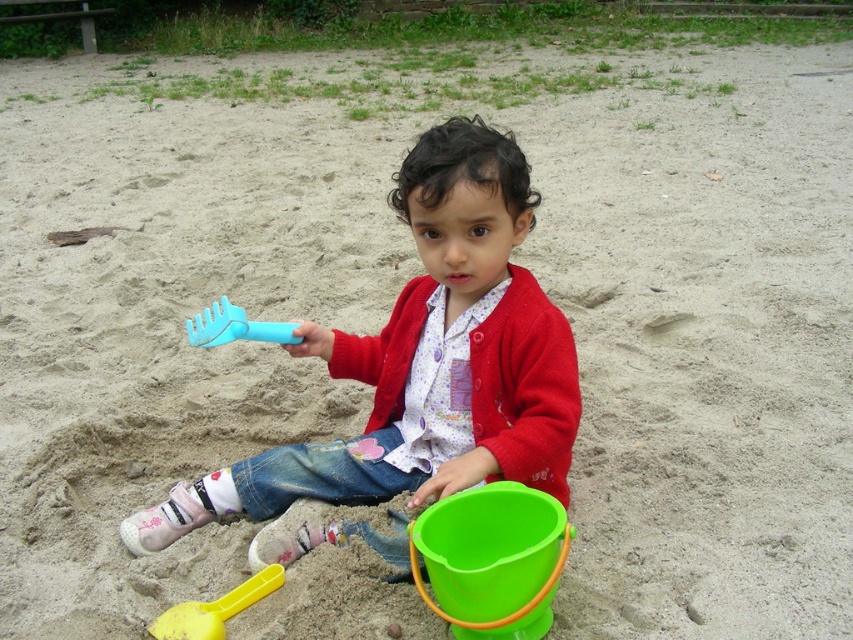
Is the position of matte plastic toddler at center less distant than that of green plastic bucket at lower center?

No, matte plastic toddler at center is further to the viewer.

In the scene shown: Measure the distance between matte plastic toddler at center and green plastic bucket at lower center.

The distance of matte plastic toddler at center from green plastic bucket at lower center is 8.41 inches.

I want to click on matte plastic toddler at center, so click(x=425, y=362).

Which is in front, point (535, 404) or point (260, 330)?

Point (535, 404) is in front.

Between matte plastic toddler at center and blue plastic rake at center, which one appears on the right side from the viewer's perspective?

matte plastic toddler at center is more to the right.

The height and width of the screenshot is (640, 853). Identify the location of matte plastic toddler at center. (425, 362).

Does green plastic bucket at lower center appear over yellow plastic shovel at lower left?

Yes, green plastic bucket at lower center is above yellow plastic shovel at lower left.

Is green plastic bucket at lower center shorter than yellow plastic shovel at lower left?

Incorrect, green plastic bucket at lower center's height does not fall short of yellow plastic shovel at lower left's.

Is point (526, 625) positioned behind point (215, 620)?

No, it is in front of (215, 620).

The width and height of the screenshot is (853, 640). Find the location of `green plastic bucket at lower center`. green plastic bucket at lower center is located at coordinates (x=491, y=560).